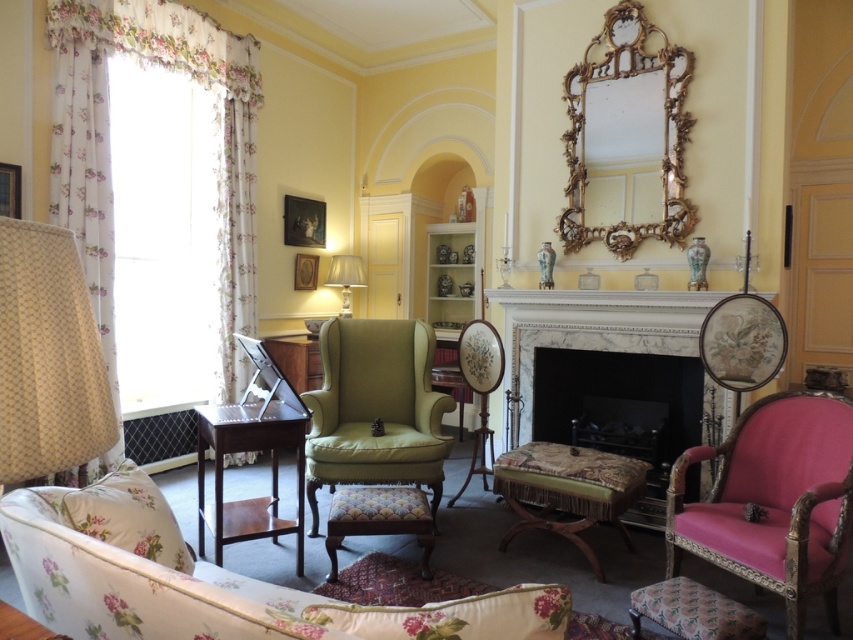
You are arranging a small potted plant that is 20 cm wide. You want to place it on the surface of either the patterned fabric ottoman at center or the wooden picture frame at upper left. Which surface can accommodate the plant without overcrowding?

The patterned fabric ottoman at center has a larger size compared to wooden picture frame at upper left, so the potted plant can be placed on the patterned fabric ottoman at center without overcrowding.

You are arranging flowers in this room and need to place a vase between the gold ornate mirror at upper center and the wooden picture frame at center. Based on their positions, which object should the vase be closer to?

The gold ornate mirror at upper center is positioned on the right side of the wooden picture frame at center, so the vase should be placed closer to the wooden picture frame at center to maintain symmetry.

Looking at this image, you are a delivery person trying to place a large package that is 3 meters long in the living room. The package needs to be placed between the floral fabric couch at lower left and the wooden picture frame at left. Do you think the space between them is long enough to fit the package?

The distance between the floral fabric couch at lower left and the wooden picture frame at left is 2.71 meters. Since the package is 3 meters long, it is longer than the available space. Therefore, the package cannot be placed between them.